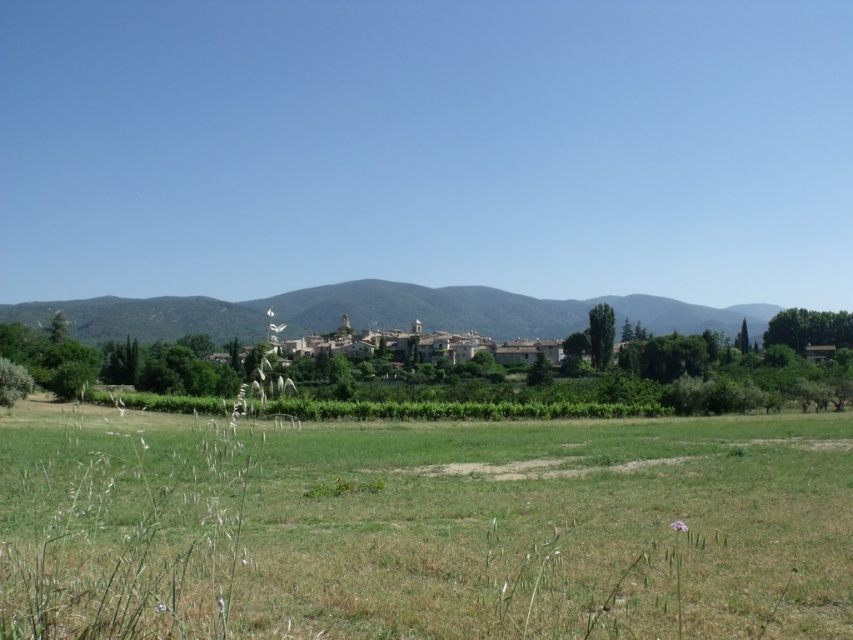
Question: Observing the image, what is the correct spatial positioning of green grassy field at lower center in reference to green grassy hill at center?

Choices:
 (A) right
 (B) left

Answer: (B)

Question: Is the position of green grassy field at lower center more distant than that of green grassy hill at center?

Choices:
 (A) yes
 (B) no

Answer: (B)

Question: Which point is farther from the camera taking this photo?

Choices:
 (A) (15, 456)
 (B) (534, 337)

Answer: (B)

Question: Is green grassy field at lower center further to the viewer compared to green grassy hill at center?

Choices:
 (A) yes
 (B) no

Answer: (B)